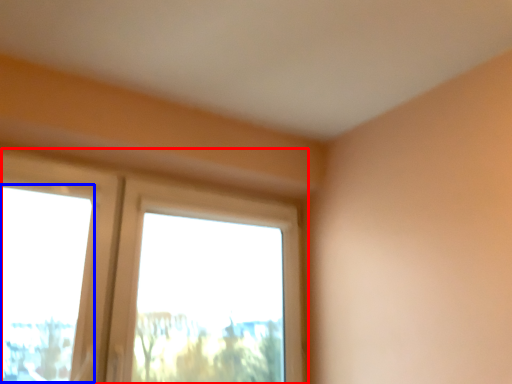
Question: Which of the following is the closest to the observer, window (highlighted by a red box) or window screen (highlighted by a blue box)?

Choices:
 (A) window
 (B) window screen

Answer: (B)